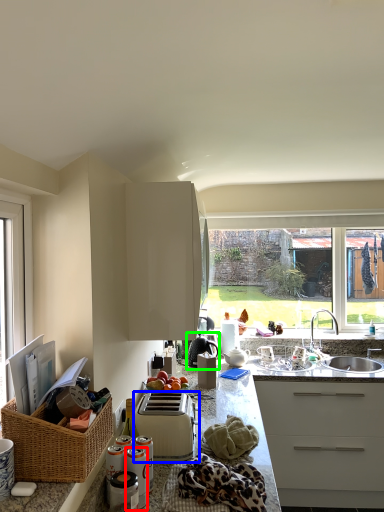
Question: Which object is the closest to the appliance (highlighted by a red box)? Choose among these: toaster (highlighted by a blue box) or appliance (highlighted by a green box).

Choices:
 (A) toaster
 (B) appliance

Answer: (A)